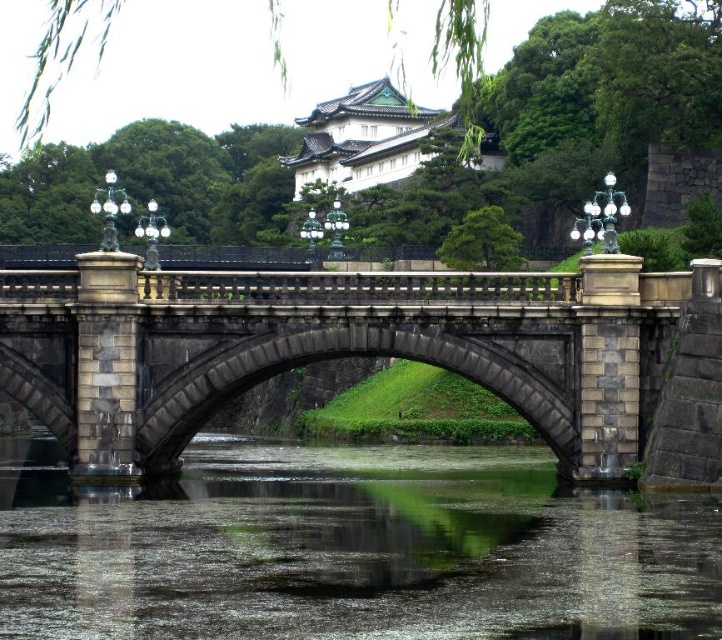
You are standing on the traditional stone bridge and notice a specific point marked at coordinates (352, 548). What is the location of this point relative to the bridge?

The point at coordinates (352, 548) corresponds to green algae covered water at center, which is located directly below the bridge in the center area.